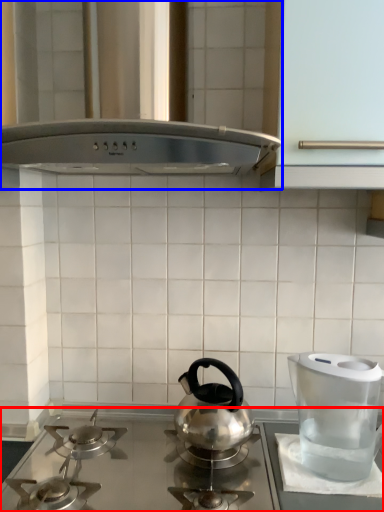
Question: Which object appears closest to the camera in this image, gas stove (highlighted by a red box) or vent (highlighted by a blue box)?

Choices:
 (A) gas stove
 (B) vent

Answer: (B)